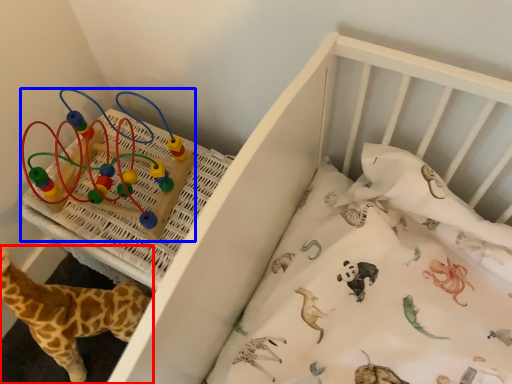
Question: Among these objects, which one is nearest to the camera, giraffe (highlighted by a red box) or toy (highlighted by a blue box)?

Choices:
 (A) giraffe
 (B) toy

Answer: (A)